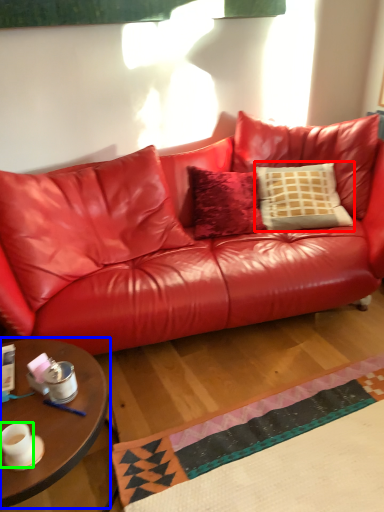
Question: Considering the real-world distances, which object is farthest from pillow (highlighted by a red box)? coffee table (highlighted by a blue box) or coffee cup (highlighted by a green box)?

Choices:
 (A) coffee table
 (B) coffee cup

Answer: (B)